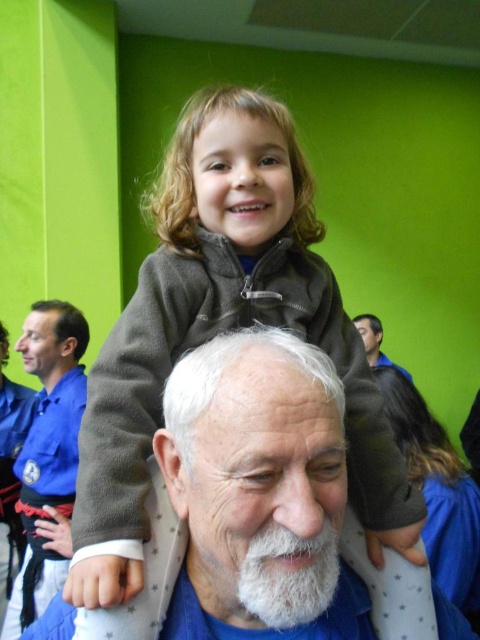
Between matte gray jacket at center and dark brown fleece jacket at upper center, which one appears on the right side from the viewer's perspective?

Positioned to the right is dark brown fleece jacket at upper center.

Which is more to the left, matte gray jacket at center or dark brown fleece jacket at upper center?

Positioned to the left is matte gray jacket at center.

This screenshot has height=640, width=480. Describe the element at coordinates (211, 337) in the screenshot. I see `matte gray jacket at center` at that location.

The width and height of the screenshot is (480, 640). Find the location of `matte gray jacket at center`. matte gray jacket at center is located at coordinates (211, 337).

Does blue fabric shirt at left lie behind dark blue shirt at upper right?

No, blue fabric shirt at left is closer to the viewer.

Who is higher up, blue fabric shirt at left or dark blue shirt at upper right?

dark blue shirt at upper right is higher up.

Image resolution: width=480 pixels, height=640 pixels. Describe the element at coordinates (48, 452) in the screenshot. I see `blue fabric shirt at left` at that location.

Where is `blue fabric shirt at left`? The width and height of the screenshot is (480, 640). blue fabric shirt at left is located at coordinates (48, 452).

Which is more to the left, white fluffy beard at center or dark blue shirt at upper right?

From the viewer's perspective, white fluffy beard at center appears more on the left side.

Is point (278, 545) farther from viewer compared to point (372, 316)?

No.

Locate an element on the screen. The width and height of the screenshot is (480, 640). white fluffy beard at center is located at coordinates (288, 576).